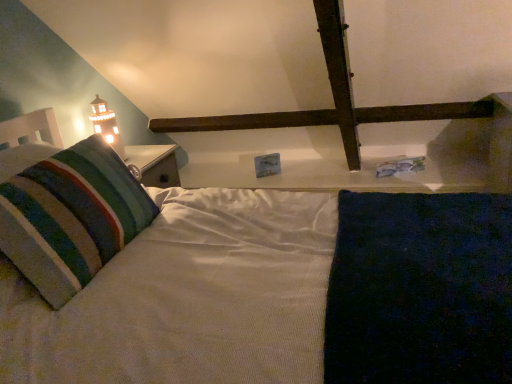
Question: Which is correct: matte white tower at upper left is inside soft striped pillow at left, or outside of it?

Choices:
 (A) inside
 (B) outside

Answer: (B)

Question: Considering their positions, is matte white tower at upper left located in front of or behind soft striped pillow at left?

Choices:
 (A) front
 (B) behind

Answer: (B)

Question: In terms of height, does matte white tower at upper left look taller or shorter compared to soft striped pillow at left?

Choices:
 (A) tall
 (B) short

Answer: (A)

Question: Is point (17, 254) positioned closer to the camera than point (97, 117)?

Choices:
 (A) closer
 (B) farther

Answer: (A)

Question: From a real-world perspective, is soft striped pillow at left positioned above or below matte white tower at upper left?

Choices:
 (A) above
 (B) below

Answer: (B)

Question: Is soft striped pillow at left in front of or behind matte white tower at upper left in the image?

Choices:
 (A) front
 (B) behind

Answer: (A)

Question: Looking at their shapes, would you say soft striped pillow at left is wider or thinner than matte white tower at upper left?

Choices:
 (A) wide
 (B) thin

Answer: (A)